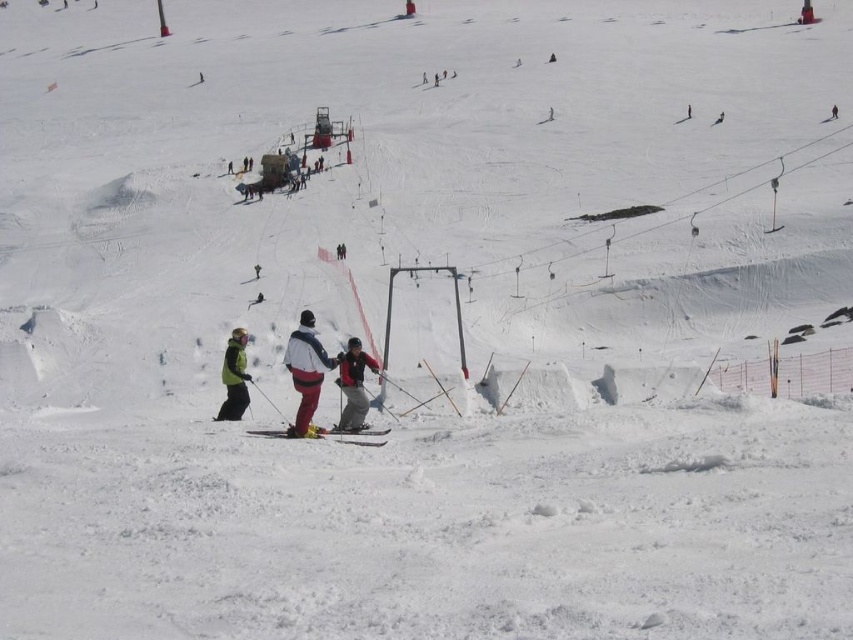
You are a photographer standing at the bottom of the slope and want to capture both the green matte jacket at lower left and the yellow matte ski at center in your photo. Which object will appear closer to the camera in the photo?

The green matte jacket at lower left will appear closer to the camera because it is further to the viewer than the yellow matte ski at center.

In the scene shown: You are a photographer standing at the bottom of the ski slope. You want to capture a photo of the white matte jacket at center and the yellow matte ski at center. Which object will appear larger in the photo?

The white matte jacket at center will appear larger in the photo because it is taller than the yellow matte ski at center.